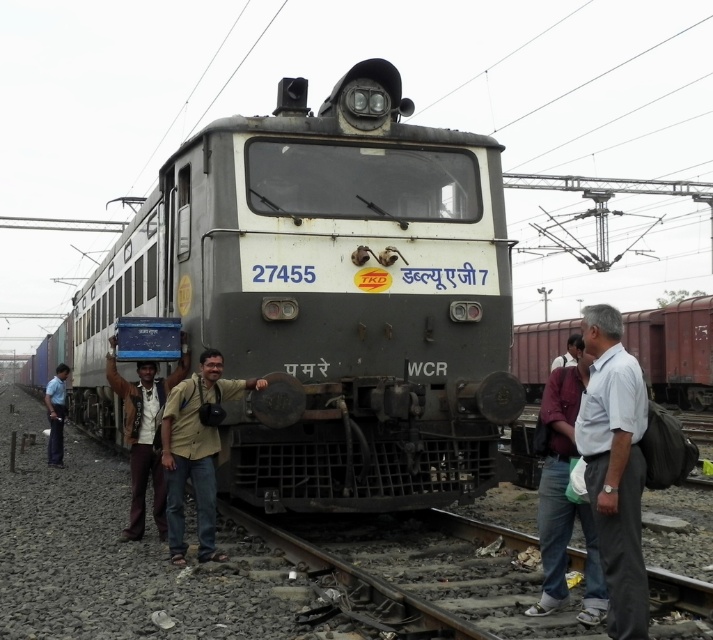
Question: Among these objects, which one is farthest from the camera?

Choices:
 (A) maroon fabric shirt at right
 (B) dark blue jeans at lower left
 (C) dark gray shirt at center
 (D) gray cotton shirt at center

Answer: (B)

Question: Considering the real-world distances, which object is farthest from the gray metallic train at center?

Choices:
 (A) dark gray shirt at center
 (B) brown leather jacket at center
 (C) gray cotton shirt at center

Answer: (C)

Question: In this image, where is gray cotton shirt at center located relative to dark blue jeans at lower left?

Choices:
 (A) above
 (B) below

Answer: (A)

Question: Which of these objects is positioned farthest from the gray cotton shirt at center?

Choices:
 (A) dark gray shirt at center
 (B) maroon fabric shirt at right
 (C) beige fabric shirt at center
 (D) rusty metal freight car at right

Answer: (D)

Question: Is brown leather jacket at center wider than dark gray shirt at center?

Choices:
 (A) yes
 (B) no

Answer: (B)

Question: Considering the relative positions of brown leather jacket at center and dark blue jeans at lower left in the image provided, where is brown leather jacket at center located with respect to dark blue jeans at lower left?

Choices:
 (A) right
 (B) left

Answer: (A)